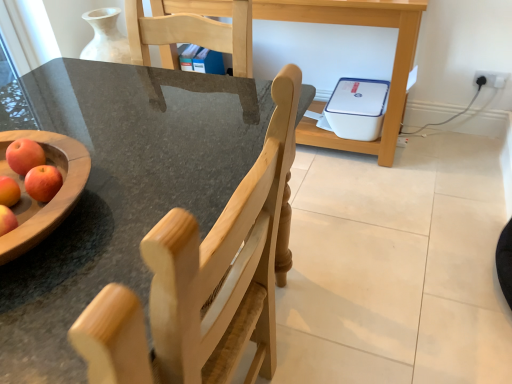
This screenshot has width=512, height=384. Describe the element at coordinates (490, 78) in the screenshot. I see `white plastic electric outlet at upper right` at that location.

Identify the location of red matte apple at left. (24, 155).

Describe the element at coordinates (358, 25) in the screenshot. This screenshot has height=384, width=512. I see `white plastic printer at center` at that location.

Identify the location of white plastic electric outlet at upper right. (490, 78).

From the image's perspective, would you say white plastic printer at center is shown under white plastic electric outlet at upper right?

No.

Between white plastic printer at center and white plastic electric outlet at upper right, which one has smaller size?

white plastic electric outlet at upper right.

In the scene shown: Is white plastic printer at center in front of or behind white plastic electric outlet at upper right in the image?

Visually, white plastic printer at center is located in front of white plastic electric outlet at upper right.

Is white plastic printer at center not near white plastic electric outlet at upper right?

Actually, white plastic printer at center and white plastic electric outlet at upper right are a little close together.

Is white plastic printer at center oriented towards natural wood chair at center?

Yes, white plastic printer at center is oriented towards natural wood chair at center.

From the image's perspective, is white plastic printer at center located above or below natural wood chair at center?

white plastic printer at center is above natural wood chair at center.

Can you tell me how much white plastic printer at center and natural wood chair at center differ in facing direction?

white plastic printer at center and natural wood chair at center are facing 89 degrees away from each other.

Between white plastic printer at center and natural wood chair at center, which one has more height?

Standing taller between the two is natural wood chair at center.

Is natural wood chair at center smaller than white plastic printer at center?

Yes.

Is natural wood chair at center not inside white plastic printer at center?

natural wood chair at center lies outside white plastic printer at center's area.

From a real-world perspective, is natural wood chair at center beneath white plastic printer at center?

Actually, natural wood chair at center is physically above white plastic printer at center in the real world.

Between red matte apple at left and natural wood chair at center, which one appears on the right side from the viewer's perspective?

From the viewer's perspective, natural wood chair at center appears more on the right side.

Measure the distance from red matte apple at left to natural wood chair at center.

They are 20.41 inches apart.

Considering the sizes of objects red matte apple at left and natural wood chair at center in the image provided, who is shorter, red matte apple at left or natural wood chair at center?

red matte apple at left is shorter.

Between point (12, 162) and point (102, 319), which one is positioned in front?

The point (102, 319) is closer.

Does natural wood chair at center appear on the left side of red matte apple at left?

No.

Who is bigger, natural wood chair at center or red matte apple at left?

With larger size is natural wood chair at center.

Identify the location of chair lying on the right of red matte apple at left. This screenshot has width=512, height=384. (x=203, y=280).

From a real-world perspective, is natural wood chair at center physically located above or below red matte apple at left?

Clearly, from a real-world perspective, natural wood chair at center is below red matte apple at left.

Is point (30, 141) positioned before point (482, 74)?

Yes, point (30, 141) is in front of point (482, 74).

Can you tell me how much red matte apple at left and white plastic electric outlet at upper right differ in facing direction?

The facing directions of red matte apple at left and white plastic electric outlet at upper right are 1.06 degrees apart.

Based on the photo, from a real-world perspective, is red matte apple at left located beneath white plastic electric outlet at upper right?

No, from a real-world perspective, red matte apple at left is not below white plastic electric outlet at upper right.

Is red matte apple at left positioned before white plastic electric outlet at upper right?

Yes, it is in front of white plastic electric outlet at upper right.

Is point (296, 10) farther from camera compared to point (26, 144)?

Yes.

Which object is wider, white plastic printer at center or red matte apple at left?

white plastic printer at center.

In the image, is white plastic printer at center on the left side or the right side of red matte apple at left?

white plastic printer at center is to the right of red matte apple at left.

Is white plastic printer at center taller or shorter than red matte apple at left?

Considering their sizes, white plastic printer at center has more height than red matte apple at left.

You are a GUI agent. You are given a task and a screenshot of the screen. Output one action in this format:
    pyautogui.click(x=<x>, y=<y>)
    Task: Click on the electric outlet behind the white plastic printer at center
    This screenshot has height=384, width=512.
    Given the screenshot: What is the action you would take?
    click(x=490, y=78)

This screenshot has width=512, height=384. I want to click on table that is under the natural wood chair at center (from a real-world perspective), so click(x=358, y=25).

Considering their positions, is white plastic electric outlet at upper right positioned closer to white plastic printer at center than red matte apple at left?

white plastic electric outlet at upper right is positioned closer to the anchor white plastic printer at center.

Looking at the image, which one is located closer to white plastic electric outlet at upper right, natural wood chair at center or red matte apple at left?

natural wood chair at center is positioned closer to the anchor white plastic electric outlet at upper right.

Estimate the real-world distances between objects in this image. Which object is closer to white plastic printer at center, white plastic electric outlet at upper right or natural wood chair at center?

The object closer to white plastic printer at center is white plastic electric outlet at upper right.

Considering their positions, is red matte apple at left positioned closer to white plastic electric outlet at upper right than white plastic printer at center?

white plastic printer at center is closer to white plastic electric outlet at upper right.

Estimate the real-world distances between objects in this image. Which object is closer to red matte apple at left, white plastic printer at center or white plastic electric outlet at upper right?

white plastic printer at center is closer to red matte apple at left.

Estimate the real-world distances between objects in this image. Which object is further from red matte apple at left, natural wood chair at center or white plastic printer at center?

white plastic printer at center lies further to red matte apple at left than the other object.

When comparing their distances from white plastic printer at center, does red matte apple at left or natural wood chair at center seem further?

red matte apple at left is further to white plastic printer at center.

Considering their positions, is white plastic printer at center positioned closer to red matte apple at left than natural wood chair at center?

Based on the image, natural wood chair at center appears to be nearer to red matte apple at left.

Image resolution: width=512 pixels, height=384 pixels. I want to click on table located between red matte apple at left and white plastic electric outlet at upper right in the left-right direction, so click(x=358, y=25).

Find the location of `apple located between natural wood chair at center and white plastic printer at center in the depth direction`. apple located between natural wood chair at center and white plastic printer at center in the depth direction is located at coordinates (24, 155).

The image size is (512, 384). I want to click on table between natural wood chair at center and white plastic electric outlet at upper right along the z-axis, so click(x=358, y=25).

Locate an element on the screen. apple between natural wood chair at center and white plastic electric outlet at upper right along the z-axis is located at coordinates (24, 155).